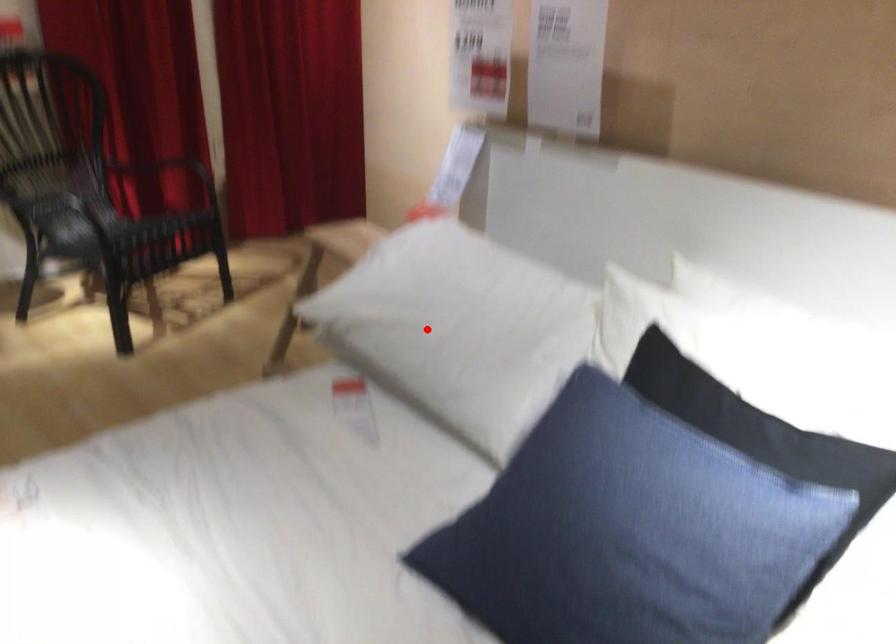
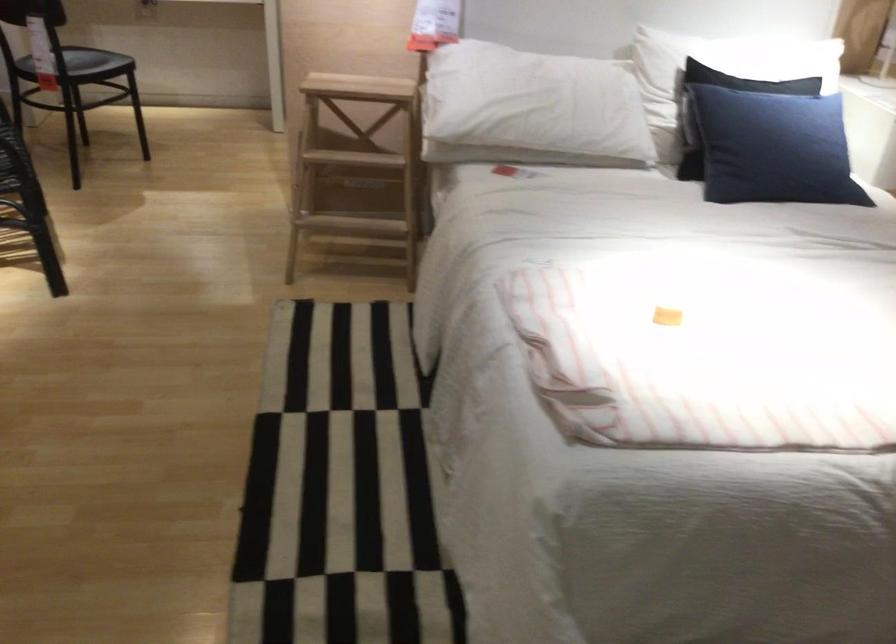
Question: I am providing you with two images of the same scene from different viewpoints. Given a red point in image1, look at the same physical point in image2. Is it:

Choices:
 (A) Closer to the viewpoint
 (B) Farther from the viewpoint

Answer: (B)